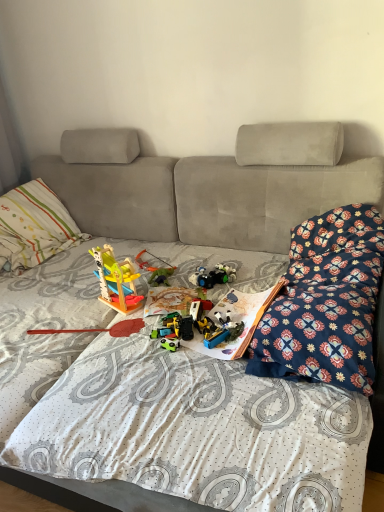
Question: Considering the positions of striped cotton pillow at left and floral-patterned fabric at right in the image, is striped cotton pillow at left bigger or smaller than floral-patterned fabric at right?

Choices:
 (A) big
 (B) small

Answer: (A)

Question: In terms of height, does striped cotton pillow at left look taller or shorter compared to floral-patterned fabric at right?

Choices:
 (A) tall
 (B) short

Answer: (A)

Question: Based on their relative distances, which object is farther from the green plastic toy at center, the fifth toy positioned from the back?

Choices:
 (A) wooden toy at center, the first toy from the back
 (B) paperboard book at center
 (C) wooden toy at center, which is counted as the 2th toy, starting from the front
 (D) floral-patterned fabric at right
 (E) striped cotton pillow at left

Answer: (E)

Question: Estimate the real-world distances between objects in this image. Which object is farther from the striped cotton pillow at left?

Choices:
 (A) wooden toy at center, which is counted as the 4th toy, starting from the back
 (B) wooden toy at center, the first toy from the back
 (C) multicolored plastic toy at center, marked as the 3th toy in a back-to-front arrangement
 (D) paperboard book at center
 (E) floral-patterned fabric at right

Answer: (E)